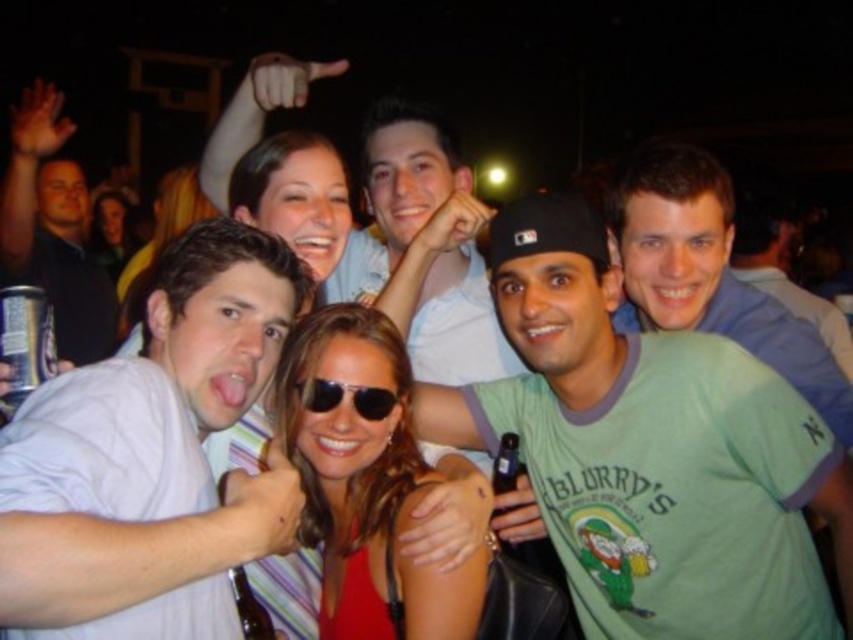
You are standing at the point labeled point (x=314, y=380) and want to take a photo of the group. The camera you have can focus on subjects within 6 feet. Will the camera be able to focus on the group?

The distance between point (x=314, y=380) and the camera is 6.42 feet. Since the camera can focus within 6 feet, the distance is slightly beyond its focusing range. Therefore, the camera may not be able to focus on the group.